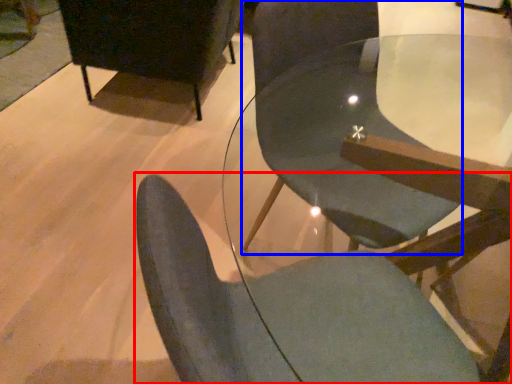
Question: Which point is further to the camera, chair (highlighted by a red box) or chair (highlighted by a blue box)?

Choices:
 (A) chair
 (B) chair

Answer: (B)